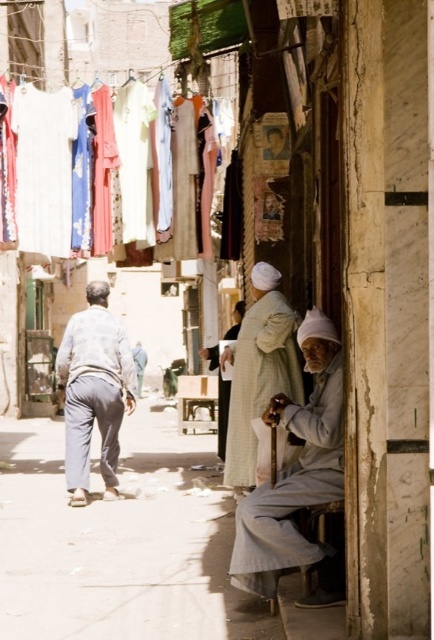
You are a delivery person who needs to place a package at point 0.762, 0.677. You see the light gray cotton robe at lower right in the scene. Is the robe at the correct location to receive the package?

The light gray cotton robe at lower right is positioned at point (293, 486), so yes, the robe is at the correct location to receive the package.

You are a tailor in this marketplace who needs to determine which item is taller between the floral fabric dresses at upper left and the light gray cotton robe at lower right. Based on the scene, which one is taller?

The floral fabric dresses at upper left are taller than the light gray cotton robe at lower right according to the description.

You are a tailor in this marketplace who needs to determine if the floral fabric dresses at upper left can fit through a doorway that is the same width as the light gray cotton robe at lower right. Can they fit?

The floral fabric dresses at upper left might be wider than the light gray cotton robe at lower right, so they might not fit through the doorway.